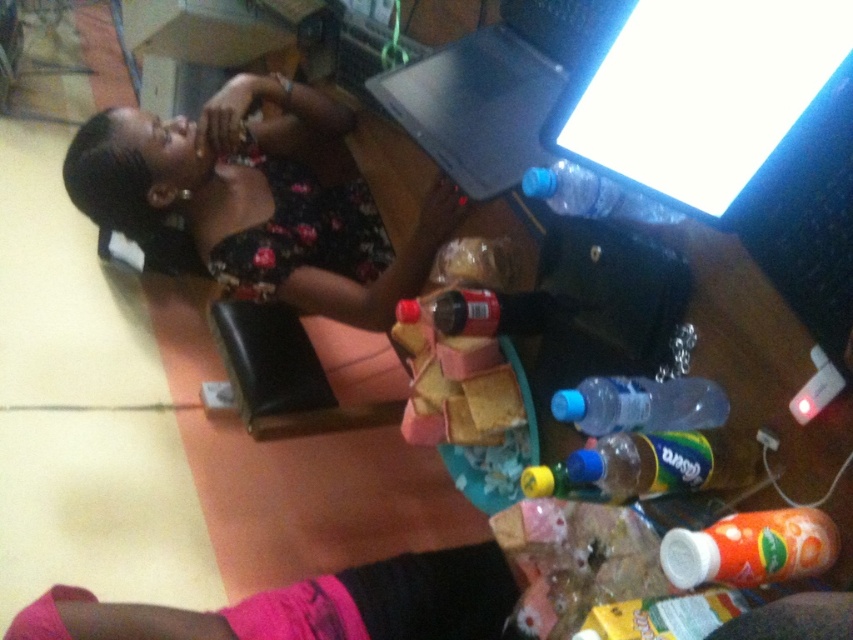
Question: Is wooden table at center to the left of black plastic laptop at upper center from the viewer's perspective?

Choices:
 (A) yes
 (B) no

Answer: (B)

Question: Which of the following is the farthest from the observer?

Choices:
 (A) (726, 531)
 (B) (647, 477)

Answer: (B)

Question: Among these points, which one is nearest to the camera?

Choices:
 (A) (514, 86)
 (B) (624, 467)
 (C) (241, 227)

Answer: (B)

Question: Is the position of wooden table at center less distant than that of green plastic bottle at lower center?

Choices:
 (A) no
 (B) yes

Answer: (B)

Question: Does green plastic bottle at lower center have a lesser width compared to transparent plastic bottle at center?

Choices:
 (A) yes
 (B) no

Answer: (B)

Question: Which of the following is the farthest from the observer?

Choices:
 (A) translucent orange juice bottle at lower right
 (B) green plastic bottle at lower center
 (C) black floral dress at upper left

Answer: (C)